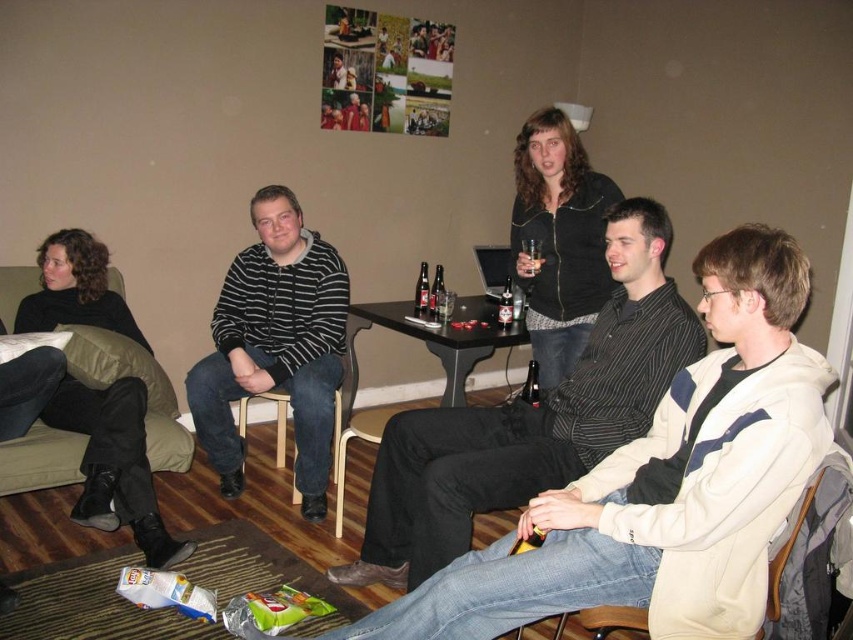
Question: Does beige fabric chair at lower right appear under translucent glass beer bottle at center?

Choices:
 (A) no
 (B) yes

Answer: (B)

Question: Can you confirm if black leather jacket at upper center is positioned to the right of translucent glass beer bottle at center?

Choices:
 (A) no
 (B) yes

Answer: (B)

Question: Which is farther from the black leather jacket at upper center?

Choices:
 (A) black wood table at center
 (B) black fabric couch at left

Answer: (B)

Question: Which point is closer to the camera?

Choices:
 (A) (515, 234)
 (B) (532, 384)

Answer: (A)

Question: Which is nearer to the black plastic table at center?

Choices:
 (A) translucent glass beer bottle at center
 (B) black fabric couch at left
 (C) striped hoodie at center

Answer: (A)

Question: Is black fabric couch at left behind matte glass beer at center table?

Choices:
 (A) no
 (B) yes

Answer: (A)